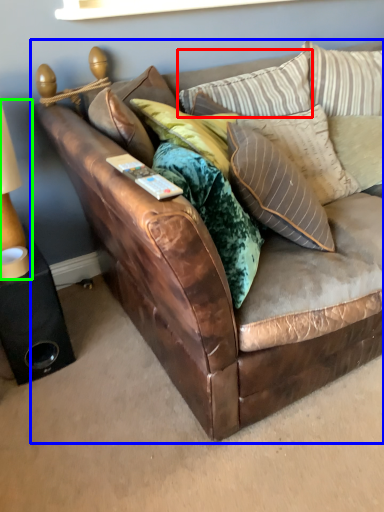
Question: Based on their relative distances, which object is nearer to pillow (highlighted by a red box)? Choose from studio couch (highlighted by a blue box) and table lamp (highlighted by a green box).

Choices:
 (A) studio couch
 (B) table lamp

Answer: (A)